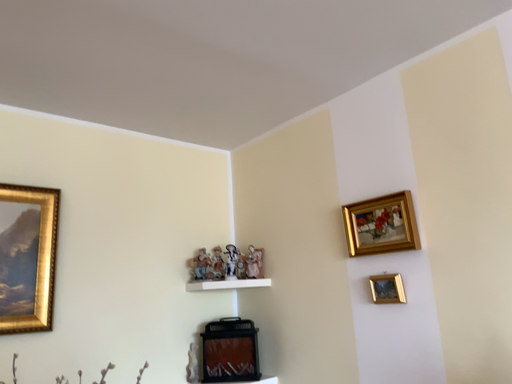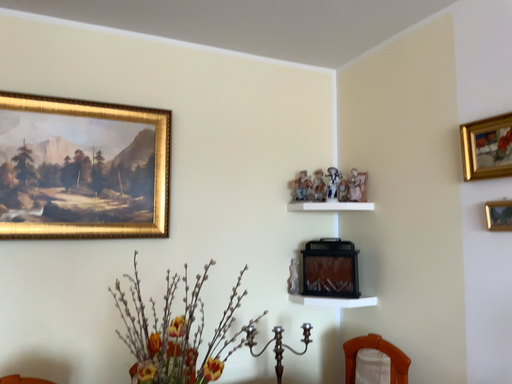
Question: How did the camera likely rotate when shooting the video?

Choices:
 (A) rotated upward
 (B) rotated downward

Answer: (B)